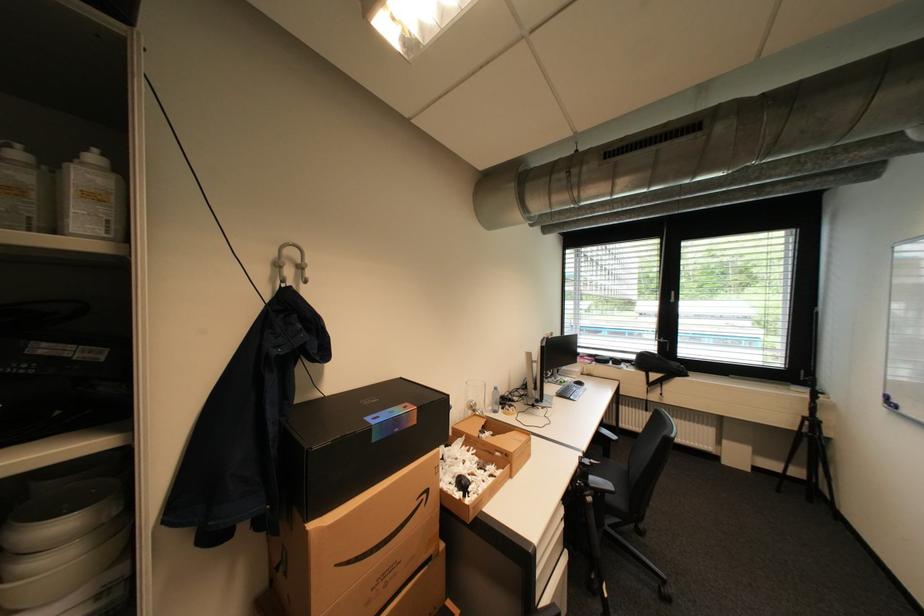
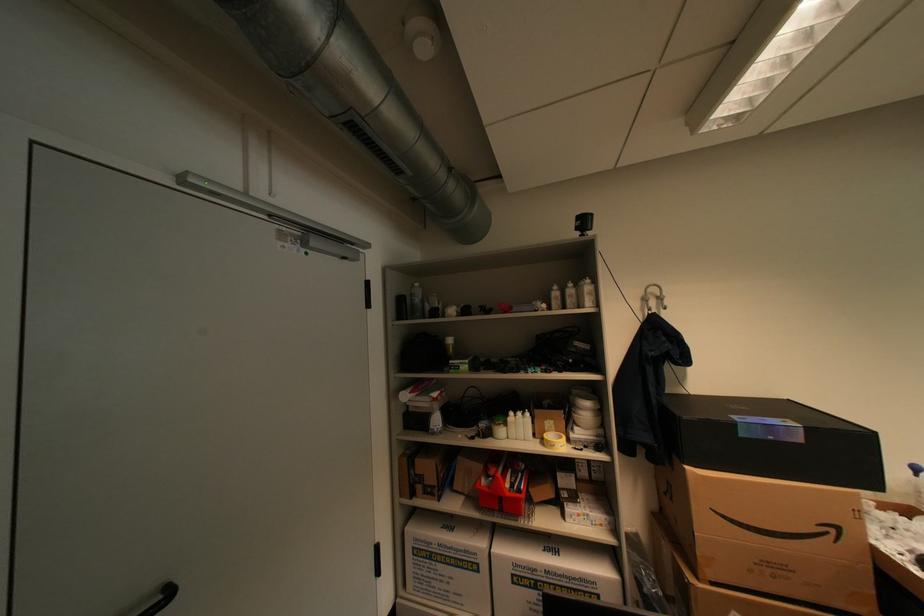
Locate, in the second image, the point that corresponds to point 446,509 in the first image.

(879, 568)